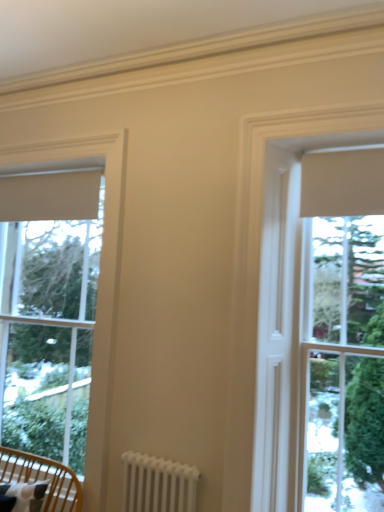
In order to face white matte window at center, should I rotate leftwards or rightwards?

Turn right approximately 14.378 degrees to face it.

This screenshot has width=384, height=512. What do you see at coordinates (99, 289) in the screenshot? I see `white matte window at left` at bounding box center [99, 289].

Image resolution: width=384 pixels, height=512 pixels. In order to click on wooden chair with cushion at lower left in this screenshot , I will do `click(43, 478)`.

Between white matte window at left and white metal radiator at lower center, which one appears on the left side from the viewer's perspective?

Positioned to the left is white matte window at left.

From a real-world perspective, between white matte window at left and white metal radiator at lower center, who is vertically lower?

In real-world perspective, white metal radiator at lower center is lower.

How many degrees apart are the facing directions of white matte window at left and white metal radiator at lower center?

They differ by 1.7 degrees in their facing directions.

Locate an element on the screen. This screenshot has width=384, height=512. radiator on the right of white matte window at left is located at coordinates (157, 484).

From their relative heights in the image, would you say wooden chair with cushion at lower left is taller or shorter than white matte window at center?

Clearly, wooden chair with cushion at lower left is shorter compared to white matte window at center.

Which object is positioned more to the right, wooden chair with cushion at lower left or white matte window at center?

white matte window at center.

In the scene shown: Are wooden chair with cushion at lower left and white matte window at center beside each other?

No, wooden chair with cushion at lower left is not with white matte window at center.

Is wooden chair with cushion at lower left outside of white matte window at center?

Absolutely, wooden chair with cushion at lower left is external to white matte window at center.

From the image's perspective, is white metal radiator at lower center over white matte window at center?

Incorrect, from the image's perspective, white metal radiator at lower center is lower than white matte window at center.

Which is behind, point (169, 487) or point (292, 429)?

Point (292, 429)

Considering the sizes of objects white metal radiator at lower center and white matte window at center in the image provided, who is shorter, white metal radiator at lower center or white matte window at center?

white metal radiator at lower center.

Which object is further away from the camera taking this photo, white metal radiator at lower center or white matte window at center?

white metal radiator at lower center is further away from the camera.

Is wooden chair with cushion at lower left positioned beyond the bounds of white matte window at left?

wooden chair with cushion at lower left lies outside white matte window at left's area.

Is wooden chair with cushion at lower left facing away from white matte window at left?

Absolutely, wooden chair with cushion at lower left is directed away from white matte window at left.

In the scene shown: Considering the relative positions of wooden chair with cushion at lower left and white matte window at left in the image provided, is wooden chair with cushion at lower left to the left of white matte window at left from the viewer's perspective?

Yes, wooden chair with cushion at lower left is to the left of white matte window at left.

From a real-world perspective, is wooden chair with cushion at lower left below white matte window at left?

Correct, in the physical world, wooden chair with cushion at lower left is lower than white matte window at left.

Do you think white matte window at center is within wooden chair with cushion at lower left, or outside of it?

white matte window at center is spatially situated outside wooden chair with cushion at lower left.

The image size is (384, 512). What are the coordinates of `bay window that appears above the wooden chair with cushion at lower left (from a real-world perspective)` in the screenshot? It's located at 321,326.

Does white matte window at center have a greater width compared to wooden chair with cushion at lower left?

No, white matte window at center is not wider than wooden chair with cushion at lower left.

Is the position of wooden chair with cushion at lower left less distant than that of white metal radiator at lower center?

No, wooden chair with cushion at lower left is further to the viewer.

Is point (52, 471) farther from camera compared to point (162, 493)?

That is True.

Are wooden chair with cushion at lower left and white metal radiator at lower center beside each other?

No.

Looking at this image, from a real-world perspective, is wooden chair with cushion at lower left positioned over white metal radiator at lower center based on gravity?

No, from a real-world perspective, wooden chair with cushion at lower left is not over white metal radiator at lower center

From the image's perspective, who appears lower, white matte window at center or white matte window at left?

white matte window at left appears lower in the image.

Are white matte window at center and white matte window at left located far from each other?

Yes.

Considering the relative positions of white matte window at center and white matte window at left in the image provided, is white matte window at center to the left of white matte window at left from the viewer's perspective?

No, white matte window at center is not to the left of white matte window at left.

This screenshot has width=384, height=512. Find the location of `radiator below the white matte window at left (from the image's perspective)`. radiator below the white matte window at left (from the image's perspective) is located at coordinates (157, 484).

The width and height of the screenshot is (384, 512). In order to click on bay window above the wooden chair with cushion at lower left (from the image's perspective) in this screenshot , I will do `click(321, 326)`.

From the image, which object appears to be nearer to white matte window at left, wooden chair with cushion at lower left or white matte window at center?

Based on the image, wooden chair with cushion at lower left appears to be nearer to white matte window at left.

Based on their spatial positions, is white matte window at left or wooden chair with cushion at lower left further from white metal radiator at lower center?

Based on the image, white matte window at left appears to be further to white metal radiator at lower center.

Looking at the image, which one is located further to white matte window at left, wooden chair with cushion at lower left or white metal radiator at lower center?

wooden chair with cushion at lower left is positioned further to the anchor white matte window at left.

Looking at this image, based on their spatial positions, is wooden chair with cushion at lower left or white matte window at left closer to white matte window at center?

white matte window at left.

Considering their positions, is white matte window at center positioned further to wooden chair with cushion at lower left than white metal radiator at lower center?

Based on the image, white matte window at center appears to be further to wooden chair with cushion at lower left.

From the image, which object appears to be nearer to white metal radiator at lower center, white matte window at center or white matte window at left?

white matte window at left is positioned closer to the anchor white metal radiator at lower center.

Looking at the image, which one is located closer to white metal radiator at lower center, wooden chair with cushion at lower left or white matte window at center?

wooden chair with cushion at lower left.

Considering their positions, is white matte window at left positioned further to wooden chair with cushion at lower left than white metal radiator at lower center?

white matte window at left.

Identify the location of radiator between white matte window at left and white matte window at center in the horizontal direction. Image resolution: width=384 pixels, height=512 pixels. (157, 484).

Where is `radiator between wooden chair with cushion at lower left and white matte window at center from left to right`? radiator between wooden chair with cushion at lower left and white matte window at center from left to right is located at coordinates (157, 484).

Identify the location of window between wooden chair with cushion at lower left and white matte window at center. The width and height of the screenshot is (384, 512). point(99,289).

This screenshot has width=384, height=512. Identify the location of radiator between white matte window at left and wooden chair with cushion at lower left vertically. (157, 484).